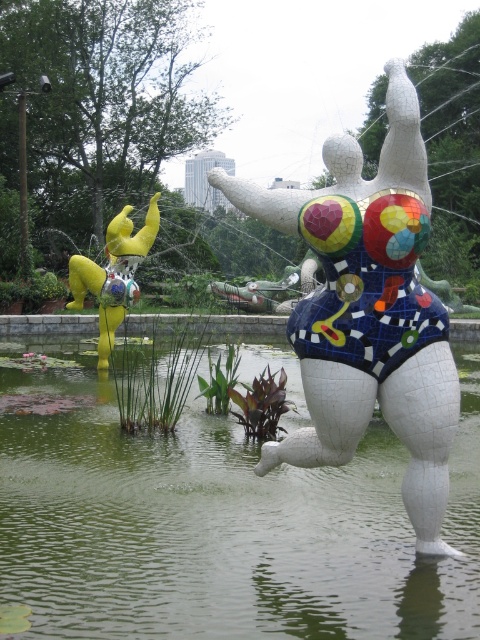
Can you confirm if green liquid water at center is thinner than cracked mosaic torso at center?

No.

Who is positioned more to the left, green liquid water at center or cracked mosaic torso at center?

From the viewer's perspective, green liquid water at center appears more on the left side.

Who is more forward, (337, 556) or (236, 184)?

Point (236, 184) is in front.

In order to click on green liquid water at center in this screenshot , I will do `click(215, 520)`.

Who is positioned more to the right, cracked mosaic torso at center or metallic yellow sculpture at left?

cracked mosaic torso at center is more to the right.

Who is more distant from viewer, (407, 291) or (73, 300)?

The point (73, 300) is more distant.

What do you see at coordinates (369, 312) in the screenshot?
I see `cracked mosaic torso at center` at bounding box center [369, 312].

You are a GUI agent. You are given a task and a screenshot of the screen. Output one action in this format:
    pyautogui.click(x=<x>, y=<y>)
    Task: Click on the cracked mosaic torso at center
    This screenshot has height=640, width=480.
    Given the screenshot: What is the action you would take?
    pyautogui.click(x=369, y=312)

Between green liquid water at center and metallic yellow sculpture at left, which one has less height?

Standing shorter between the two is green liquid water at center.

Which is more to the right, green liquid water at center or metallic yellow sculpture at left?

green liquid water at center is more to the right.

Who is more distant from viewer, (250, 614) or (108, 284)?

Positioned behind is point (108, 284).

This screenshot has width=480, height=640. Find the location of `green liquid water at center`. green liquid water at center is located at coordinates (215, 520).